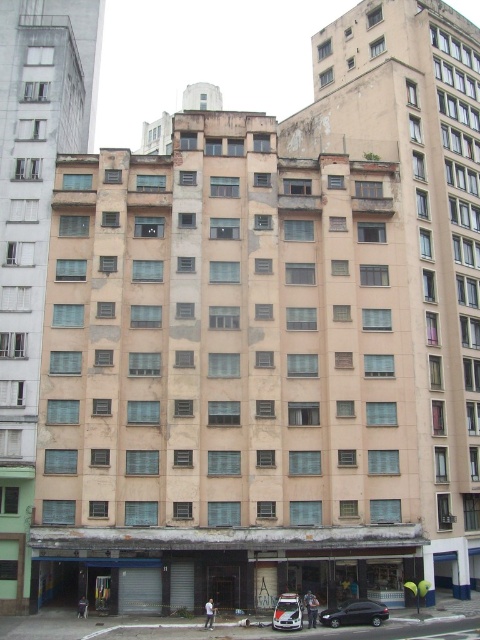
Can you confirm if black glossy car at lower center is smaller than white glossy car at center?

No, black glossy car at lower center is not smaller than white glossy car at center.

Can you confirm if black glossy car at lower center is thinner than white glossy car at center?

No.

Is point (376, 618) positioned in front of point (297, 604)?

No, (376, 618) is further to viewer.

At what (x,y) coordinates should I click in order to perform the action: click on black glossy car at lower center. Please return your answer as a coordinate pair (x, y). This screenshot has height=640, width=480. Looking at the image, I should click on (355, 612).